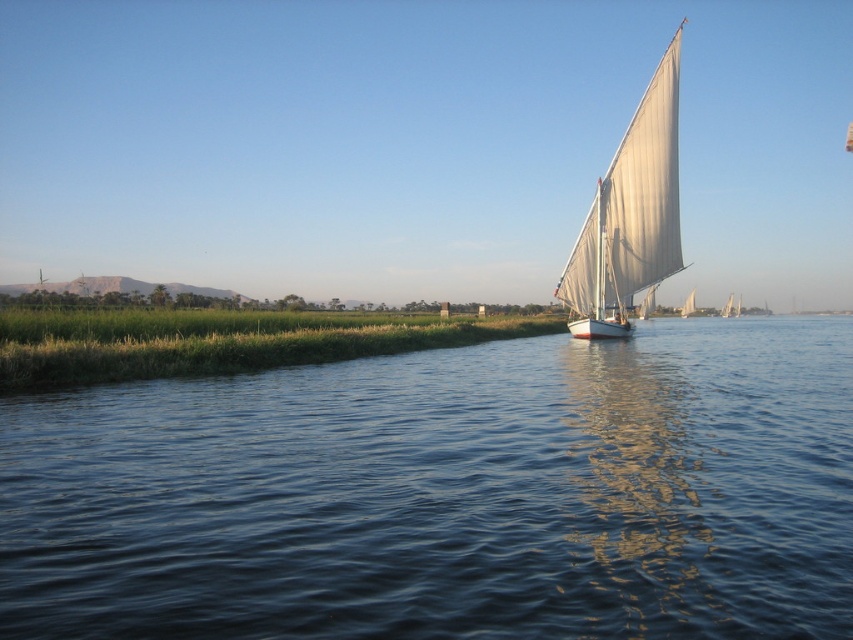
Question: Among these points, which one is nearest to the camera?

Choices:
 (A) (653, 234)
 (B) (79, 413)

Answer: (B)

Question: Is blue water at center further to the viewer compared to white canvas sailboat at right?

Choices:
 (A) yes
 (B) no

Answer: (B)

Question: Can you confirm if blue water at center is smaller than white canvas sailboat at right?

Choices:
 (A) yes
 (B) no

Answer: (A)

Question: Does blue water at center come behind white canvas sailboat at right?

Choices:
 (A) no
 (B) yes

Answer: (A)